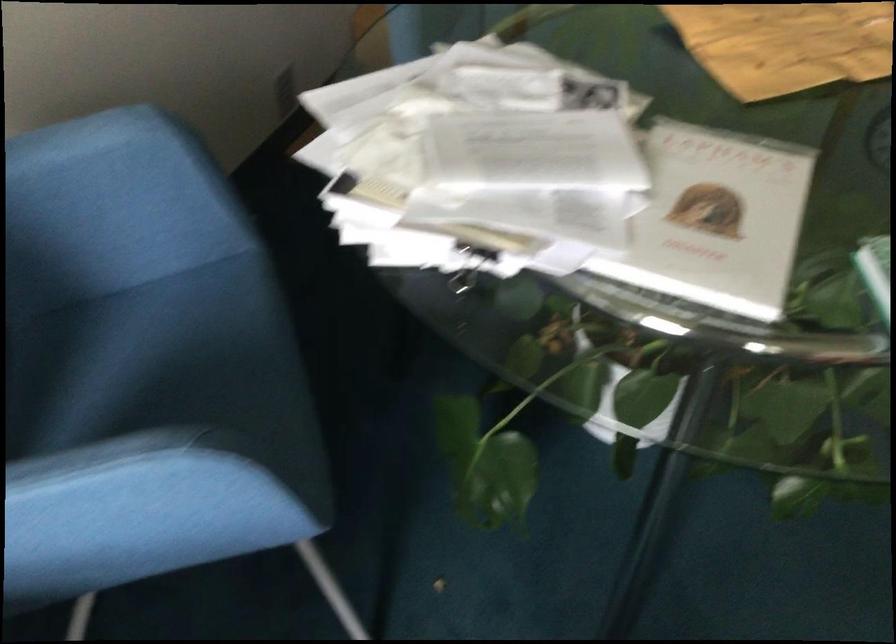
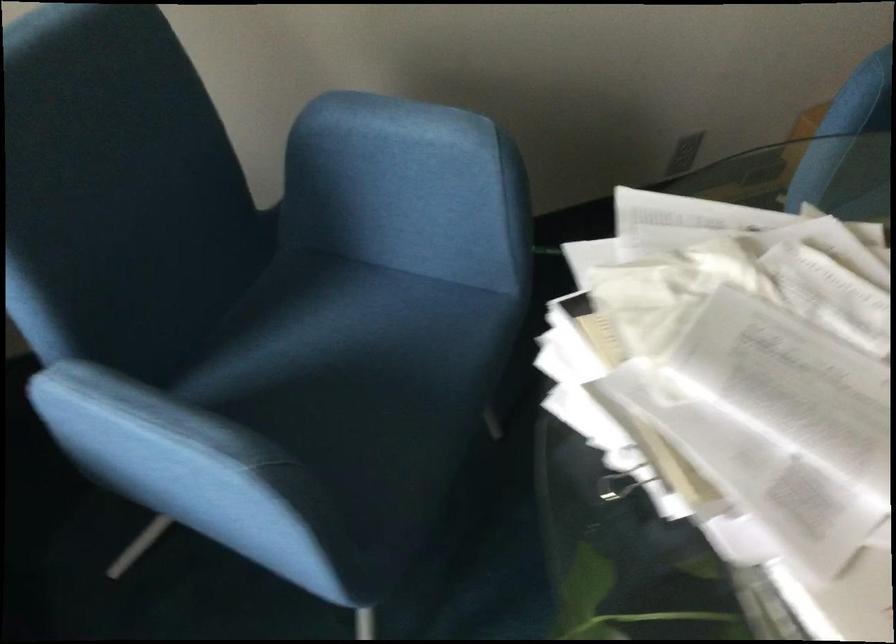
Question: The images are taken continuously from a first-person perspective. In which direction is your viewpoint rotating?

Choices:
 (A) Left
 (B) Right
 (C) Up
 (D) Down

Answer: (A)